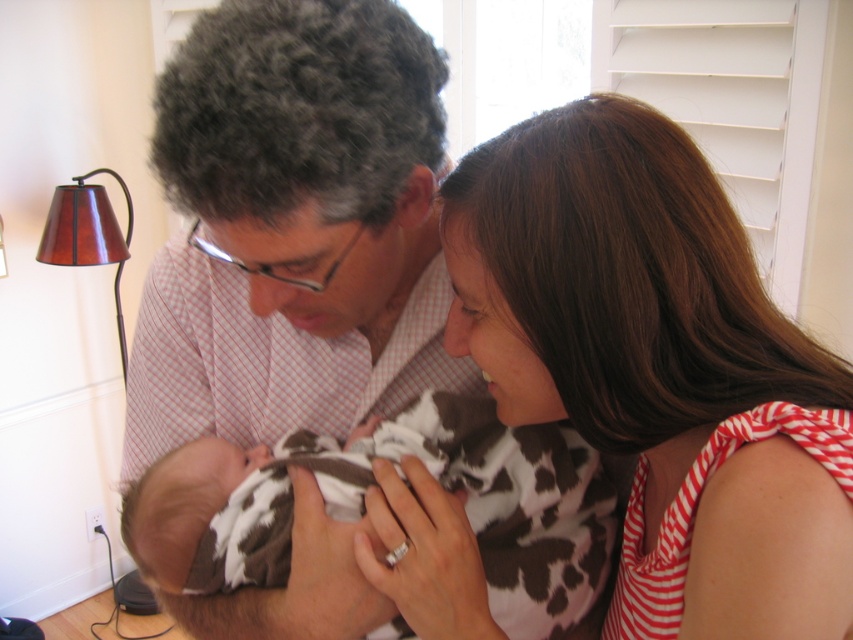
You are a photographer setting up a shoot in this living room. You need to decide which garment to use as a backdrop. The matte pink shirt at center and the cow print fabric at center are both available. Based on their sizes, which one would you choose for a larger backdrop?

The matte pink shirt at center is larger in size than the cow print fabric at center, so the matte pink shirt at center would be better suited as a larger backdrop.

You are a photographer trying to capture a closeup of the matte pink shirt at center and the striped fabric dress at center. Since you can only focus on one object at a time, which one should you focus on to ensure the other is still somewhat in the frame?

You should focus on the matte pink shirt at center because it is in front of the striped fabric dress at center, so focusing on the front object will keep the other in the background of the frame.